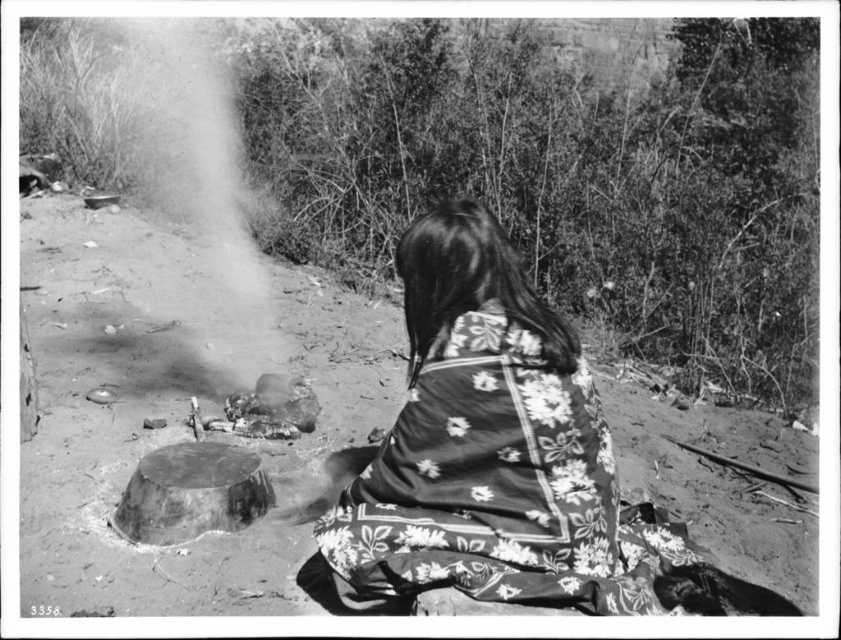
What do you see at coordinates (484, 444) in the screenshot? The image size is (841, 640). I see `floral fabric shawl at center` at bounding box center [484, 444].

Is floral fabric shawl at center below smoke/ash cloud at center?

Yes.

You are a GUI agent. You are given a task and a screenshot of the screen. Output one action in this format:
    pyautogui.click(x=<x>, y=<y>)
    Task: Click on the floral fabric shawl at center
    This screenshot has width=841, height=640.
    Given the screenshot: What is the action you would take?
    pyautogui.click(x=484, y=444)